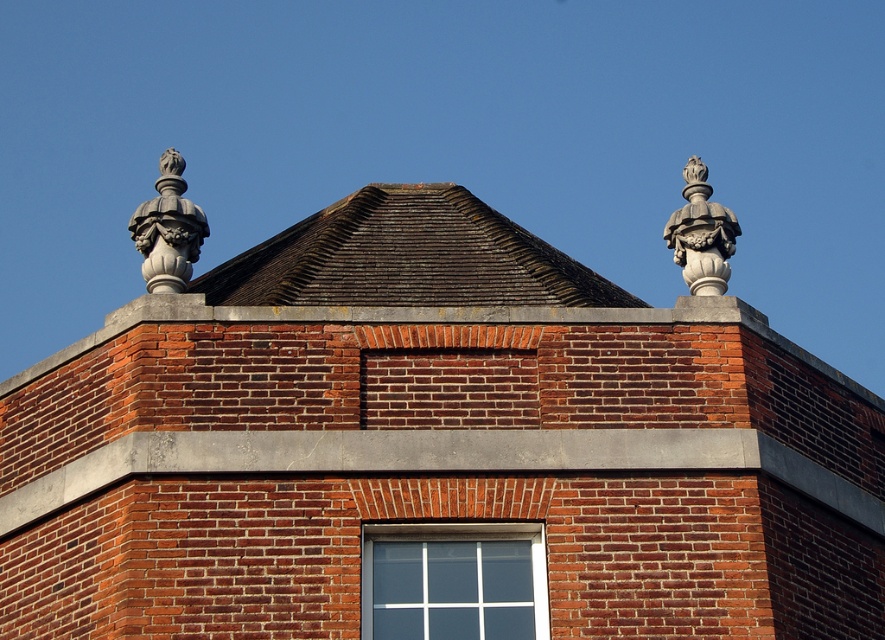
You are an architect inspecting the building facade. You notice the brown shingles at center and the white glass window at center. Based on their positions, which object is located to the right of the other?

The brown shingles at center is positioned on the left side of white glass window at center, so the white glass window at center is to the right of the brown shingles at center.

You are standing in front of the brick building and notice the gray stone finial at upper left and the white stone ornament at upper right. Which object is closer to you?

The gray stone finial at upper left is closer to you because it is in front of the white stone ornament at upper right.